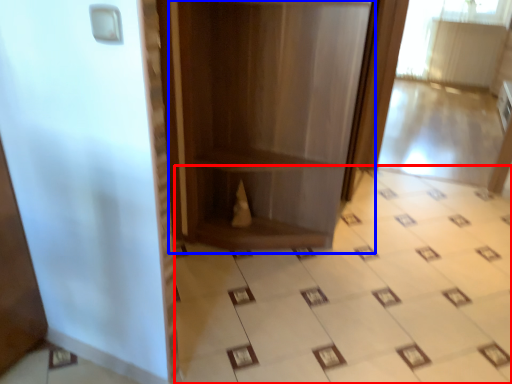
Question: Which of the following is the closest to the observer, ceramic tile (highlighted by a red box) or bookshelf (highlighted by a blue box)?

Choices:
 (A) ceramic tile
 (B) bookshelf

Answer: (A)